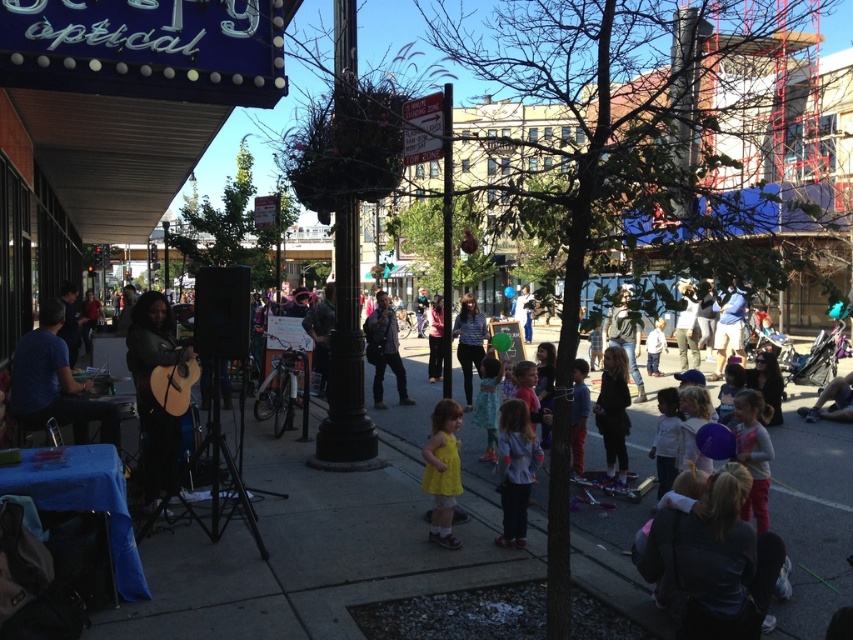
Question: Which object is positioned closest to the light blue jeans at center?

Choices:
 (A) striped shirt at center
 (B) light purple shirt at center
 (C) black leather jacket at center
 (D) pink fabric dress at center

Answer: (A)

Question: Can you confirm if dark gray sweater at lower right is smaller than yellow matte dress at center?

Choices:
 (A) yes
 (B) no

Answer: (B)

Question: From the image, what is the correct spatial relationship of pink fabric dress at center in relation to light blue jeans at center?

Choices:
 (A) left
 (B) right

Answer: (A)

Question: From the image, what is the correct spatial relationship of light pink fabric dress at lower right in relation to matte brown acoustic guitar at center?

Choices:
 (A) left
 (B) right

Answer: (B)

Question: Considering the real-world distances, which object is farthest from the light blue jeans at center?

Choices:
 (A) matte black guitar at left
 (B) pink fabric dress at center
 (C) blue fabric table at lower left
 (D) light purple shirt at center

Answer: (C)

Question: Which object is farther from the camera taking this photo?

Choices:
 (A) dark gray jeans at center
 (B) dark gray sweater at lower right

Answer: (A)